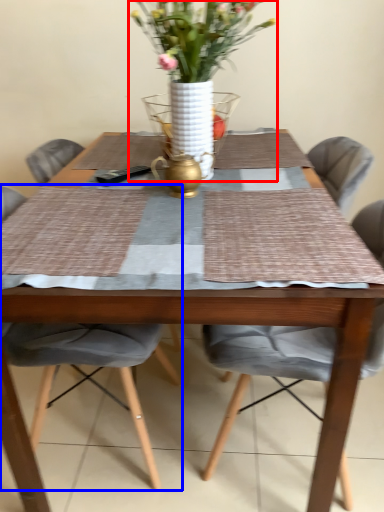
Question: Which object appears farthest to the camera in this image, houseplant (highlighted by a red box) or chair (highlighted by a blue box)?

Choices:
 (A) houseplant
 (B) chair

Answer: (B)